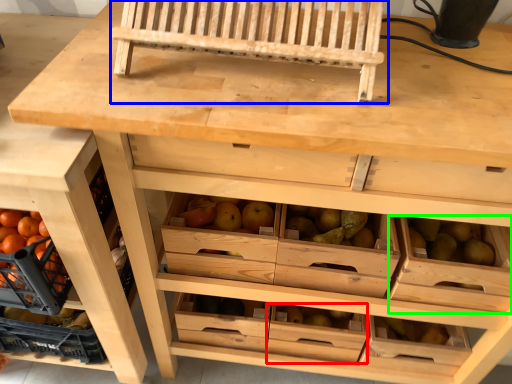
Question: Which object is the farthest from drawer (highlighted by a red box)? Choose among these: church bench (highlighted by a blue box) or drawer (highlighted by a green box).

Choices:
 (A) church bench
 (B) drawer

Answer: (A)